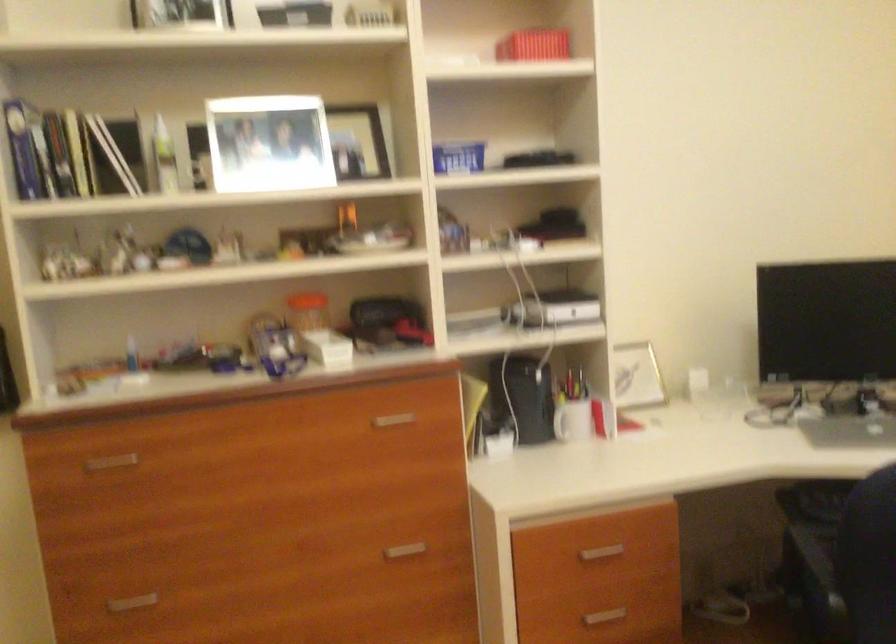
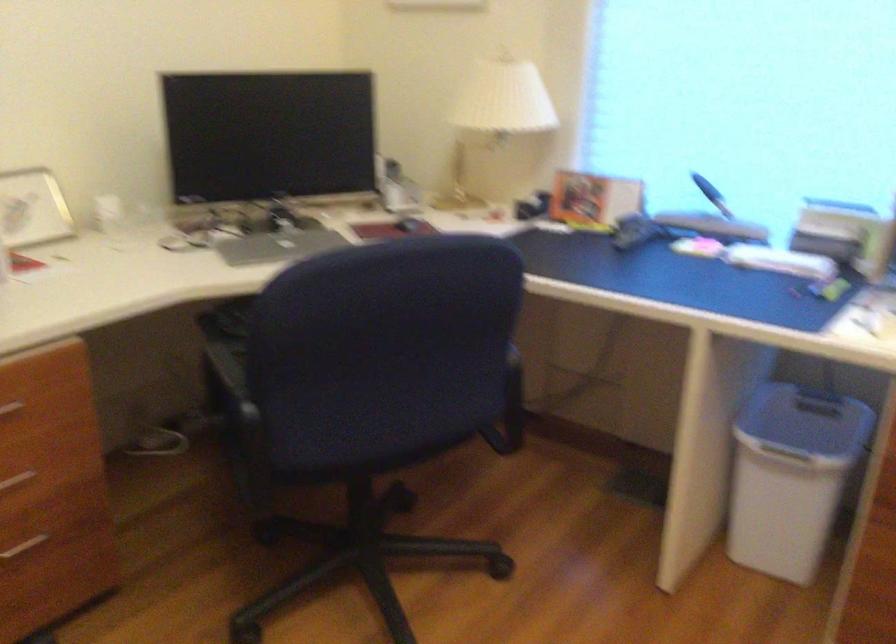
Question: How did the camera likely rotate?

Choices:
 (A) Left
 (B) Right
 (C) Up
 (D) Down

Answer: (B)